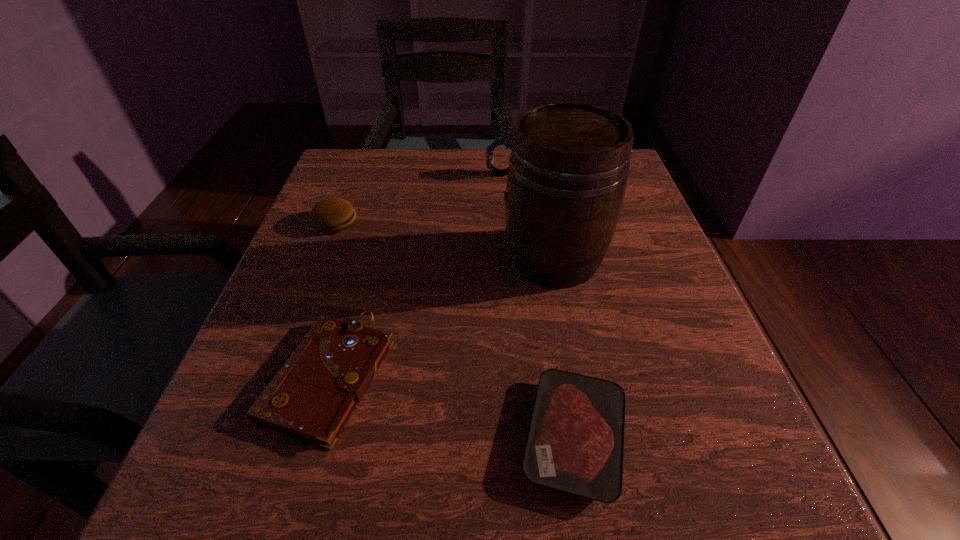
In the image, there is a desktop. At what (x,y) coordinates should I click in order to perform the action: click on vacant space at the far edge. Please return your answer as a coordinate pair (x, y). Looking at the image, I should click on (444, 177).

Locate an element on the screen. blank space at the near edge is located at coordinates (481, 477).

You are a GUI agent. You are given a task and a screenshot of the screen. Output one action in this format:
    pyautogui.click(x=<x>, y=<y>)
    Task: Click on the free space at the left edge of the desktop
    
    Given the screenshot: What is the action you would take?
    pyautogui.click(x=334, y=234)

Image resolution: width=960 pixels, height=540 pixels. Identify the location of free space at the right edge. (674, 273).

The width and height of the screenshot is (960, 540). I want to click on vacant area at the far left corner of the desktop, so click(x=380, y=192).

Identify the location of vacant space at the near left corner. The width and height of the screenshot is (960, 540). (307, 502).

Locate an element on the screen. The width and height of the screenshot is (960, 540). blank region between the shortest object and the cider is located at coordinates (564, 347).

Where is `free space between the tallest object and the patty`? The image size is (960, 540). free space between the tallest object and the patty is located at coordinates (444, 240).

At what (x,y) coordinates should I click in order to perform the action: click on vacant space that's between the third tallest object and the shortest object. Please return your answer as a coordinate pair (x, y). This screenshot has height=540, width=960. Looking at the image, I should click on (455, 329).

This screenshot has width=960, height=540. In order to click on empty location between the tallest object and the shortest object in this screenshot , I will do `click(564, 347)`.